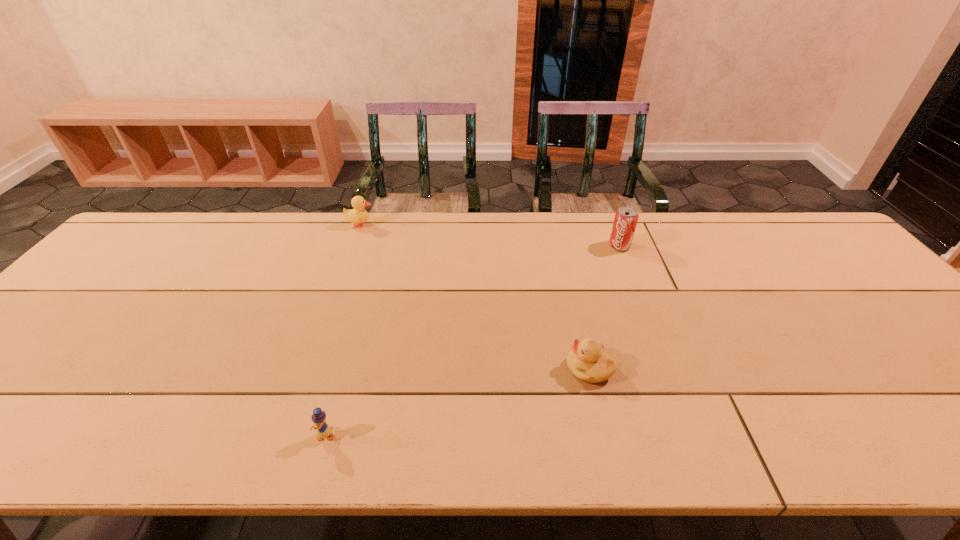
In order to click on vacant space that's between the second tallest object and the second nearest object in this screenshot , I will do `click(475, 297)`.

In order to click on object that stands as the second closest to the leftmost duckling in this screenshot , I will do `click(587, 362)`.

Point out which object is positioned as the third nearest to the rightmost object. Please provide its 2D coordinates. Your answer should be formatted as a tuple, i.e. [(x, y)], where the tuple contains the x and y coordinates of a point satisfying the conditions above.

[(323, 430)]

Select which duckling appears as the second closest to the nearest object. Please provide its 2D coordinates. Your answer should be formatted as a tuple, i.e. [(x, y)], where the tuple contains the x and y coordinates of a point satisfying the conditions above.

[(359, 215)]

Choose which duckling is the nearest neighbor to the third object from left to right. Please provide its 2D coordinates. Your answer should be formatted as a tuple, i.e. [(x, y)], where the tuple contains the x and y coordinates of a point satisfying the conditions above.

[(323, 430)]

Find the location of a particular element. The height and width of the screenshot is (540, 960). free space that satisfies the following two spatial constraints: 1. on the beak of the rightmost duckling; 2. on the face of the nearest duckling, where the monocle is placed is located at coordinates (605, 435).

At what (x,y) coordinates should I click in order to perform the action: click on vacant space that satisfies the following two spatial constraints: 1. on the front-facing side of the rightmost object; 2. on the left side of the farthest duckling. Please return your answer as a coordinate pair (x, y). The image size is (960, 540). Looking at the image, I should click on (353, 246).

At what (x,y) coordinates should I click in order to perform the action: click on vacant space that satisfies the following two spatial constraints: 1. on the beak of the rightmost duckling; 2. on the face of the nearest duckling, where the monocle is placed. Please return your answer as a coordinate pair (x, y). The image size is (960, 540). Looking at the image, I should click on click(x=605, y=435).

Image resolution: width=960 pixels, height=540 pixels. Find the location of `vacant area in the image that satisfies the following two spatial constraints: 1. on the front-facing side of the farthest object; 2. on the right side of the soda can`. vacant area in the image that satisfies the following two spatial constraints: 1. on the front-facing side of the farthest object; 2. on the right side of the soda can is located at coordinates (353, 246).

Where is `free space that satisfies the following two spatial constraints: 1. on the front-facing side of the third shortest object; 2. on the right side of the rightmost object`? free space that satisfies the following two spatial constraints: 1. on the front-facing side of the third shortest object; 2. on the right side of the rightmost object is located at coordinates (353, 246).